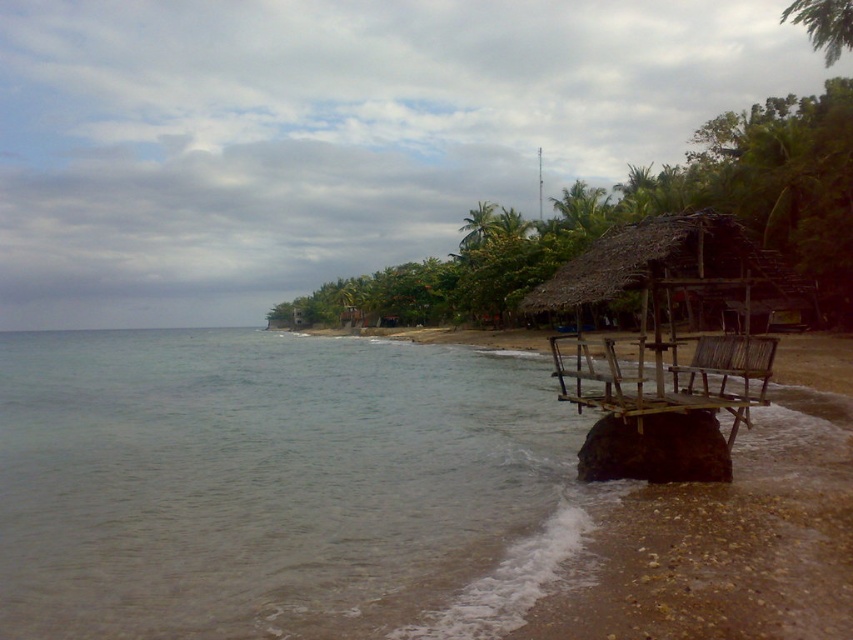
You are standing on the beach and want to reach the thatched wood hut at right without getting your feet wet. The clear water at lower left is between you and the hut. Can you walk directly to the hut without stepping into the water?

The clear water at lower left is 42.26 feet away from the thatched wood hut at right. Since the water is between you and the hut, you would have to step into it to reach the hut. Therefore, you cannot walk directly to the thatched wood hut at right without getting your feet wet.

You are standing on the beach looking at the coastal scene. There are two points marked in the image, point A at coordinates point (538, 305) and point B at coordinates point (592, 220). Which point is closer to you?

Point point (538, 305) is closer to the viewer than point point (592, 220).

You are standing at the center of the beach in the image. You want to find the clear water at lower left. Which direction should you walk to reach it?

You should walk towards the lower left direction to reach the clear water at lower left.